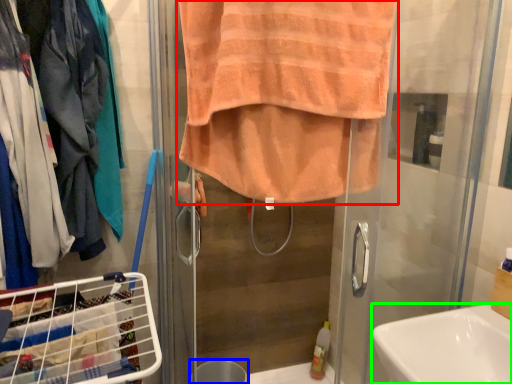
Question: Which object is positioned closest to towel (highlighted by a red box)? Select from trash bin/can (highlighted by a blue box) and sink (highlighted by a green box).

Choices:
 (A) trash bin/can
 (B) sink

Answer: (B)